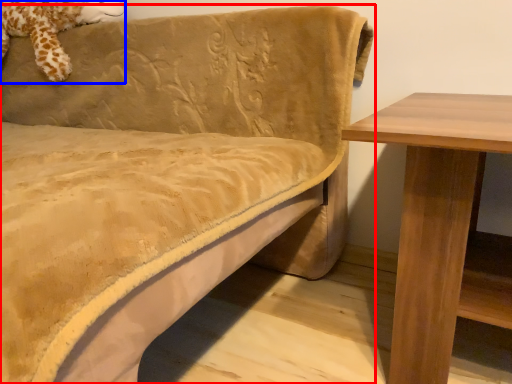
Question: Among these objects, which one is farthest to the camera, studio couch (highlighted by a red box) or animal (highlighted by a blue box)?

Choices:
 (A) studio couch
 (B) animal

Answer: (B)